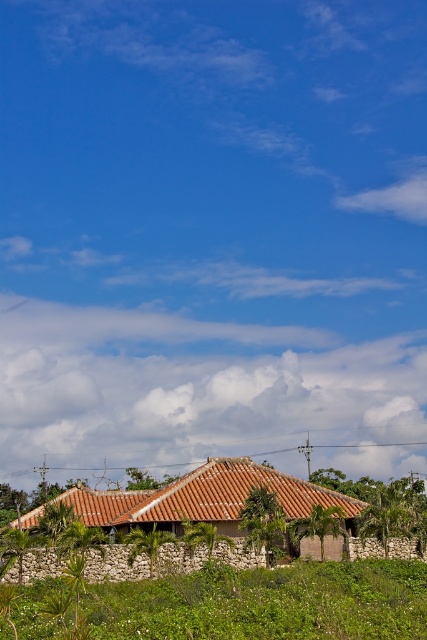
You are standing in the garden of the traditional house. You see the green leafy vegetation at lower center and the brown clay roof at center. Which object is closer to you?

→ The green leafy vegetation at lower center is closer to you because it is in front of the brown clay roof at center.

You are standing in the middle of the garden and see the point marked at coordinates (266, 604). What does this point represent in the scene?

The point at coordinates (266, 604) represents the green leafy vegetation at lower center in the scene.

You are a bird looking for a place to perch. You see the green leafy vegetation at lower center and the brown clay roof at center. Which location would allow you to sit higher?

The green leafy vegetation at lower center is much taller than the brown clay roof at center, so you can perch higher there.